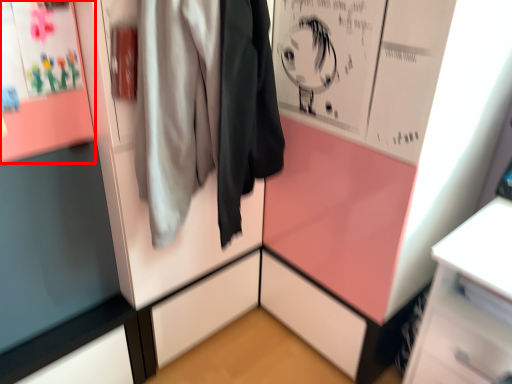
Question: Where is poster page (annotated by the red box) located in relation to jacket in the image?

Choices:
 (A) right
 (B) left

Answer: (B)